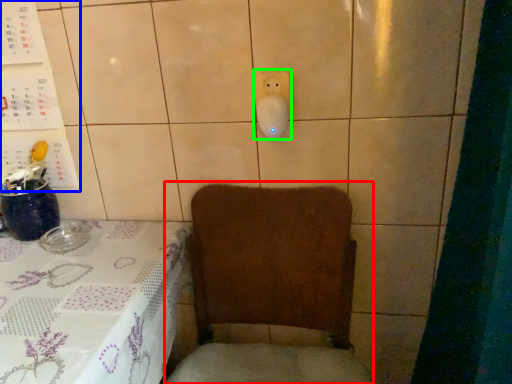
Question: Estimate the real-world distances between objects in this image. Which object is closer to armchair (highlighted by a red box), bulletin board (highlighted by a blue box) or electric outlet (highlighted by a green box)?

Choices:
 (A) bulletin board
 (B) electric outlet

Answer: (B)